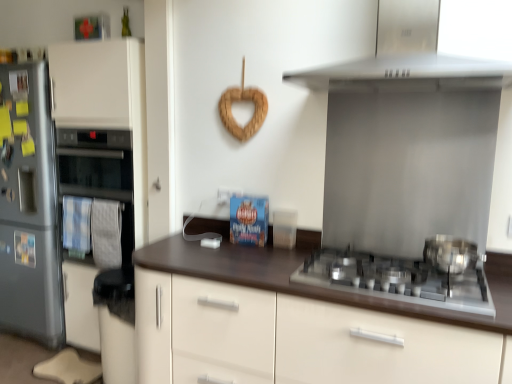
Question: Is polished stainless steel pot at right turned away from brown matte countertop at center?

Choices:
 (A) no
 (B) yes

Answer: (A)

Question: Are polished stainless steel pot at right and brown matte countertop at center far apart?

Choices:
 (A) yes
 (B) no

Answer: (B)

Question: Does polished stainless steel pot at right contain brown matte countertop at center?

Choices:
 (A) yes
 (B) no

Answer: (B)

Question: Does polished stainless steel pot at right have a larger size compared to brown matte countertop at center?

Choices:
 (A) yes
 (B) no

Answer: (B)

Question: Is polished stainless steel pot at right smaller than brown matte countertop at center?

Choices:
 (A) yes
 (B) no

Answer: (A)

Question: Can we say polished stainless steel pot at right lies outside brown matte countertop at center?

Choices:
 (A) yes
 (B) no

Answer: (B)

Question: Considering the relative sizes of satin white oven at left and polished stainless steel pot at right in the image provided, is satin white oven at left smaller than polished stainless steel pot at right?

Choices:
 (A) yes
 (B) no

Answer: (B)

Question: Is satin white oven at left wider than polished stainless steel pot at right?

Choices:
 (A) yes
 (B) no

Answer: (B)

Question: Does satin white oven at left come in front of polished stainless steel pot at right?

Choices:
 (A) yes
 (B) no

Answer: (B)

Question: From the image's perspective, is satin white oven at left beneath polished stainless steel pot at right?

Choices:
 (A) no
 (B) yes

Answer: (A)

Question: Can you confirm if satin white oven at left is positioned to the right of polished stainless steel pot at right?

Choices:
 (A) no
 (B) yes

Answer: (A)

Question: Can you confirm if satin white oven at left is thinner than polished stainless steel pot at right?

Choices:
 (A) yes
 (B) no

Answer: (A)

Question: Could you tell me if satin silver gas stove at lower right is facing polished stainless steel pot at right?

Choices:
 (A) yes
 (B) no

Answer: (B)